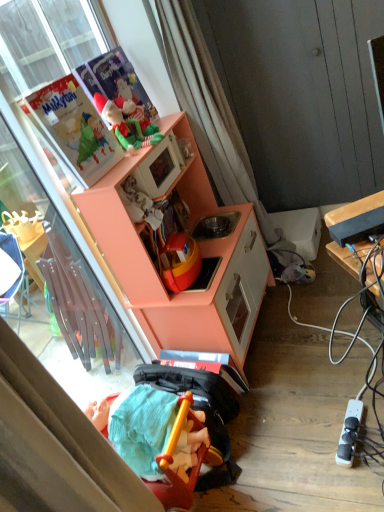
Locate an element on the screen. The height and width of the screenshot is (512, 384). unoccupied space behind white plastic power outlet at lower right is located at coordinates (321, 397).